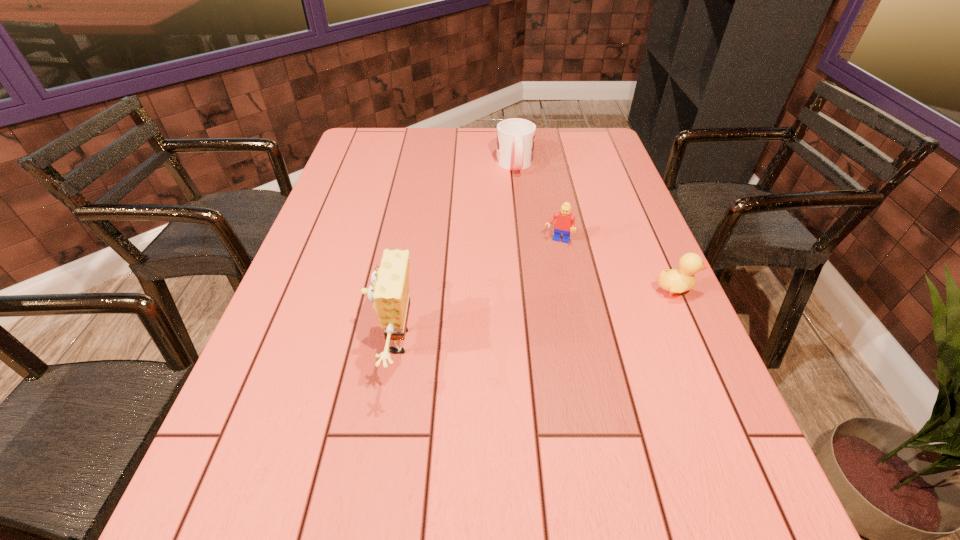
This screenshot has width=960, height=540. I want to click on vacant space located 0.050m on the side of the farthest object with the handle, so click(x=518, y=188).

Image resolution: width=960 pixels, height=540 pixels. Find the location of `vacant space situated 0.360m on the front-facing side of the third nearest object`. vacant space situated 0.360m on the front-facing side of the third nearest object is located at coordinates (517, 352).

Find the location of `free space located 0.330m on the front-facing side of the third nearest object`. free space located 0.330m on the front-facing side of the third nearest object is located at coordinates (521, 341).

Identify the location of free spot located 0.330m on the front-facing side of the third nearest object. The height and width of the screenshot is (540, 960). (521, 341).

Locate an element on the screen. The image size is (960, 540). object that is positioned at the far edge is located at coordinates (515, 140).

Identify the location of object positioned at the right edge. (680, 280).

Find the location of a particular element. free point at the far edge is located at coordinates click(479, 152).

Where is `blank area at the left edge`? blank area at the left edge is located at coordinates (325, 238).

In the image, there is a desktop. At what (x,y) coordinates should I click in order to perform the action: click on vacant space at the right edge. Please return your answer as a coordinate pair (x, y). This screenshot has height=540, width=960. Looking at the image, I should click on (638, 228).

At what (x,y) coordinates should I click in order to perform the action: click on vacant point at the far left corner. Please return your answer as a coordinate pair (x, y). The width and height of the screenshot is (960, 540). Looking at the image, I should click on (368, 155).